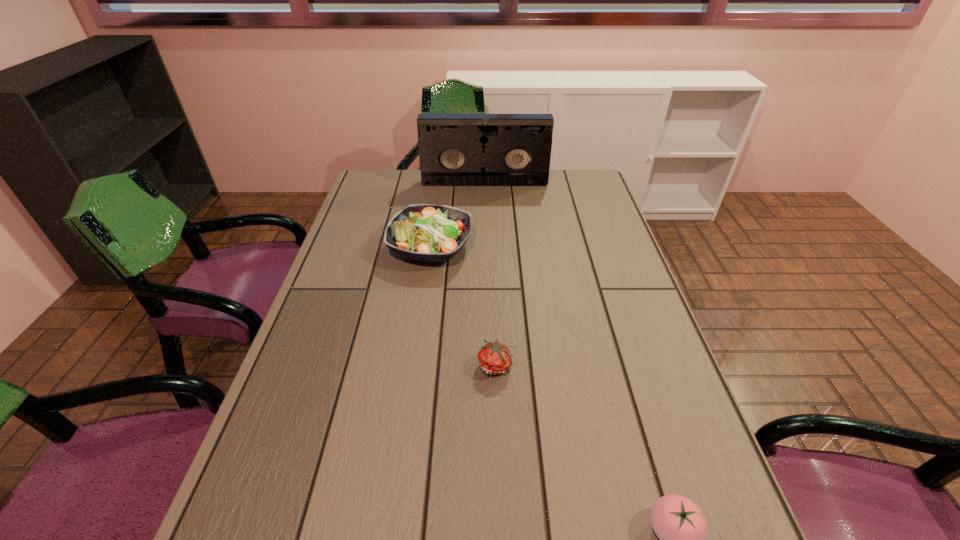
This screenshot has width=960, height=540. In order to click on object that is the third closest to the shorter tomato in this screenshot , I will do `click(454, 149)`.

Locate an element on the screen. This screenshot has height=540, width=960. object that is the third nearest to the salad plate is located at coordinates (678, 522).

Locate an element on the screen. This screenshot has height=540, width=960. vacant point that satisfies the following two spatial constraints: 1. on the front side of the tallest object; 2. on the left side of the shorter tomato is located at coordinates (488, 366).

What are the coordinates of `vacant space that satisfies the following two spatial constraints: 1. on the front side of the second farthest object; 2. on the left side of the second nearest object` in the screenshot? It's located at (415, 366).

Find the location of `free space that satisfies the following two spatial constraints: 1. on the front side of the videotape; 2. on the right side of the shorter tomato`. free space that satisfies the following two spatial constraints: 1. on the front side of the videotape; 2. on the right side of the shorter tomato is located at coordinates [x=488, y=366].